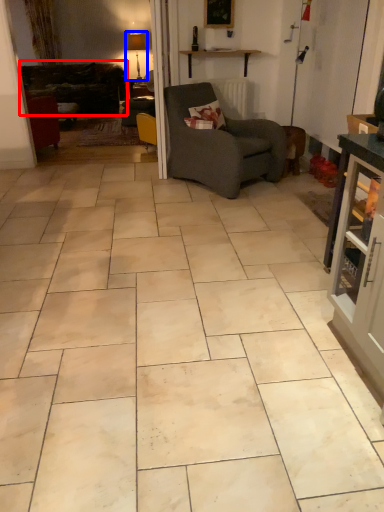
Question: Which object is closer to the camera taking this photo, studio couch (highlighted by a red box) or lamp (highlighted by a blue box)?

Choices:
 (A) studio couch
 (B) lamp

Answer: (A)